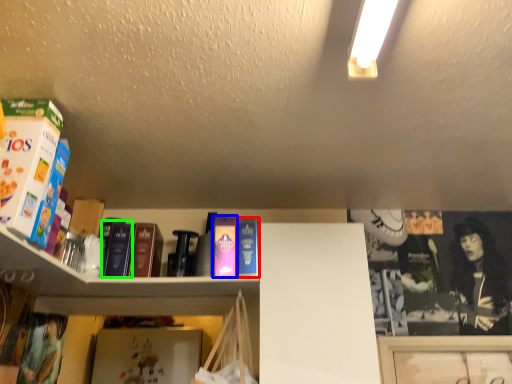
Question: Which object is positioned farthest from paperback book (highlighted by a red box)? Select from paperback book (highlighted by a blue box) and book (highlighted by a green box).

Choices:
 (A) paperback book
 (B) book

Answer: (B)